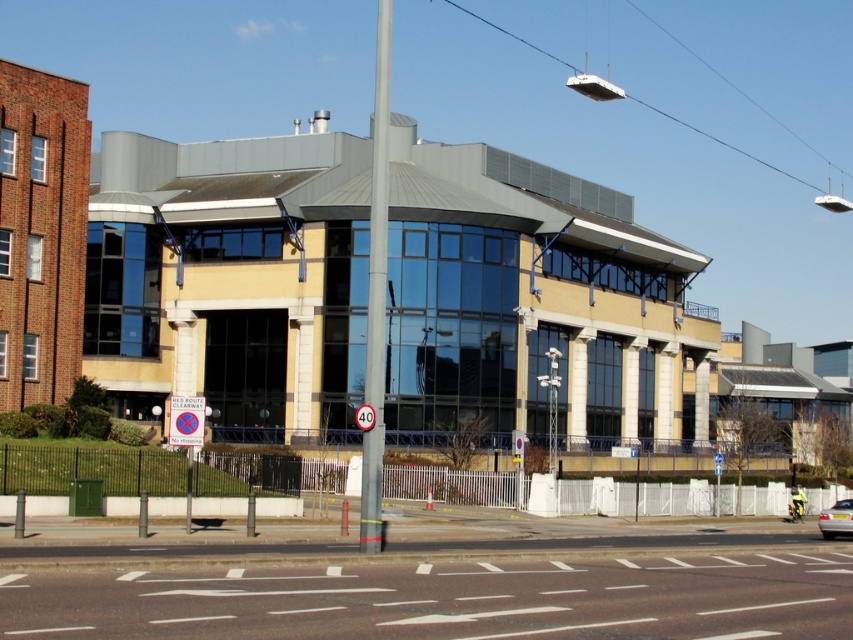
Question: Which point is farther to the camera?

Choices:
 (A) red plastic sign at center
 (B) silver metallic car at lower right
 (C) metallic pole at center
 (D) white asphalt at center

Answer: (B)

Question: From the image, what is the correct spatial relationship of white asphalt at center in relation to silver metallic car at lower right?

Choices:
 (A) right
 (B) left

Answer: (B)

Question: Which object is positioned closest to the red plastic sign at center?

Choices:
 (A) silver metallic car at lower right
 (B) white asphalt at center
 (C) metallic pole at center

Answer: (B)

Question: Does white asphalt at center lie in front of red plastic sign at center?

Choices:
 (A) yes
 (B) no

Answer: (A)

Question: Estimate the real-world distances between objects in this image. Which object is farther from the silver metallic car at lower right?

Choices:
 (A) red plastic sign at center
 (B) white asphalt at center

Answer: (A)

Question: Is red plastic sign at center in front of silver metallic car at lower right?

Choices:
 (A) yes
 (B) no

Answer: (A)